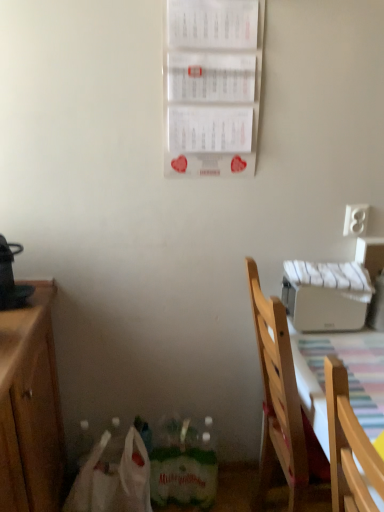
Question: From a real-world perspective, is white paper calendar at upper center above or below white plastic electric outlet at right?

Choices:
 (A) above
 (B) below

Answer: (A)

Question: Looking at the image, does white paper calendar at upper center seem bigger or smaller compared to white plastic electric outlet at right?

Choices:
 (A) big
 (B) small

Answer: (A)

Question: Which object is positioned farthest from the striped fabric tablecloth at lower right?

Choices:
 (A) white matte printer at upper right
 (B) light wood chair at lower right
 (C) white plastic electric outlet at right
 (D) white paper calendar at upper center
 (E) white plastic bag at lower left

Answer: (D)

Question: Which object is positioned closest to the striped fabric tablecloth at lower right?

Choices:
 (A) white plastic bag at lower left
 (B) white paper calendar at upper center
 (C) light wood chair at lower right
 (D) white plastic electric outlet at right
 (E) white matte printer at upper right

Answer: (C)